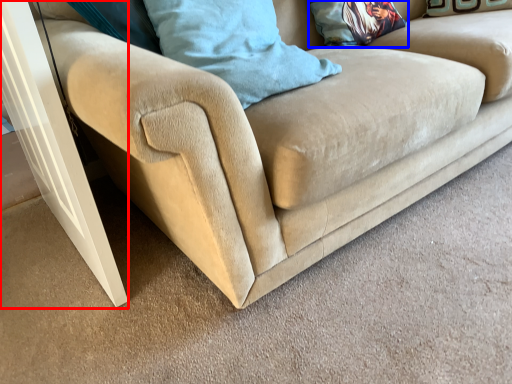
Question: Which object appears farthest to the camera in this image, screen door (highlighted by a red box) or pillow (highlighted by a blue box)?

Choices:
 (A) screen door
 (B) pillow

Answer: (B)